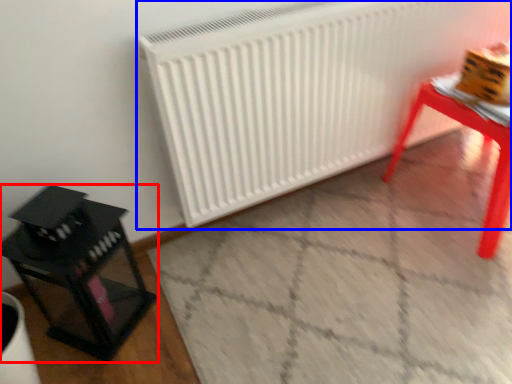
Question: Among these objects, which one is farthest to the camera, furniture (highlighted by a red box) or radiator (highlighted by a blue box)?

Choices:
 (A) furniture
 (B) radiator

Answer: (B)